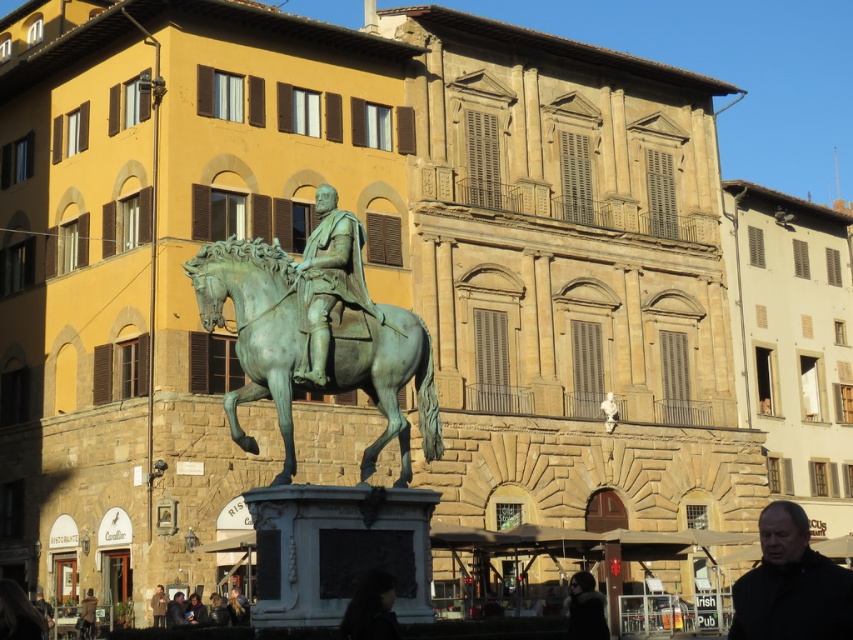
Who is positioned more to the right, bronze statue at center or brown leather jacket at lower center?

bronze statue at center is more to the right.

Can you confirm if bronze statue at center is bigger than brown leather jacket at lower center?

Yes, bronze statue at center is bigger than brown leather jacket at lower center.

This screenshot has width=853, height=640. In order to click on bronze statue at center in this screenshot , I will do `click(328, 280)`.

Does dark brown leather jacket at lower center have a lesser height compared to brown leather jacket at lower center?

No.

Does point (572, 616) lie behind point (160, 627)?

No.

This screenshot has height=640, width=853. Identify the location of dark brown leather jacket at lower center. (585, 609).

Is point (363, 384) closer to camera compared to point (158, 620)?

Yes, point (363, 384) is closer to viewer.

Does green patina horse at center appear under brown leather jacket at lower center?

No.

Which is behind, point (199, 268) or point (164, 600)?

Point (164, 600)

Identify the location of green patina horse at center. This screenshot has height=640, width=853. (303, 346).